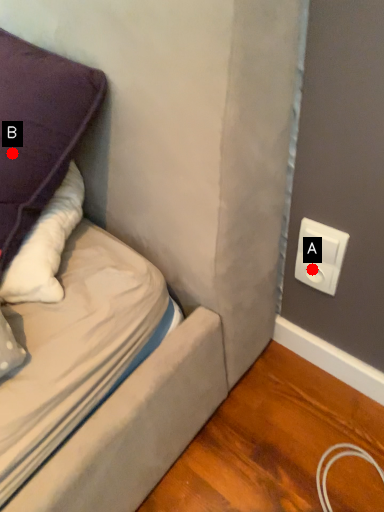
Question: Two points are circled on the image, labeled by A and B beside each circle. Which point is farther from the camera taking this photo?

Choices:
 (A) A is further
 (B) B is further

Answer: (A)